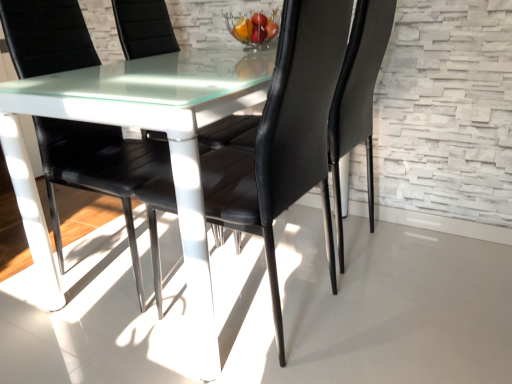
Question: Does black leather chair at center, arranged as the second chair when viewed from the right, appear on the right side of black leather chair at center, the first chair viewed from the right?

Choices:
 (A) no
 (B) yes

Answer: (A)

Question: Is the depth of black leather chair at center, which ranks as the third chair in left-to-right order, less than that of black leather chair at center, the first chair viewed from the right?

Choices:
 (A) yes
 (B) no

Answer: (A)

Question: Does black leather chair at center, which ranks as the third chair in left-to-right order, appear on the left side of black leather chair at center, the first chair viewed from the right?

Choices:
 (A) yes
 (B) no

Answer: (A)

Question: Can you confirm if black leather chair at center, arranged as the second chair when viewed from the right, is shorter than black leather chair at center, the first chair viewed from the right?

Choices:
 (A) no
 (B) yes

Answer: (A)

Question: From the image's perspective, is black leather chair at center, which ranks as the third chair in left-to-right order, above black leather chair at center, the first chair viewed from the right?

Choices:
 (A) no
 (B) yes

Answer: (A)

Question: Looking at their shapes, would you say black leather chair at center, the first chair positioned from the left, is wider or thinner than black leather chair at center, the fourth chair in the left-to-right sequence?

Choices:
 (A) wide
 (B) thin

Answer: (A)

Question: Which is correct: black leather chair at center, which is the 4th chair from right to left, is inside black leather chair at center, the first chair viewed from the right, or outside of it?

Choices:
 (A) inside
 (B) outside

Answer: (B)

Question: In terms of size, does black leather chair at center, which is the 4th chair from right to left, appear bigger or smaller than black leather chair at center, the fourth chair in the left-to-right sequence?

Choices:
 (A) big
 (B) small

Answer: (A)

Question: In terms of height, does black leather chair at center, which is the 4th chair from right to left, look taller or shorter compared to black leather chair at center, the fourth chair in the left-to-right sequence?

Choices:
 (A) short
 (B) tall

Answer: (B)

Question: In terms of height, does black leather chair at center, which appears as the 3th chair when viewed from the right, look taller or shorter compared to black leather chair at center, which ranks as the third chair in left-to-right order?

Choices:
 (A) tall
 (B) short

Answer: (B)

Question: Considering the positions of black leather chair at center, marked as the 2th chair in a left-to-right arrangement, and black leather chair at center, which ranks as the third chair in left-to-right order, in the image, is black leather chair at center, marked as the 2th chair in a left-to-right arrangement, wider or thinner than black leather chair at center, which ranks as the third chair in left-to-right order,?

Choices:
 (A) thin
 (B) wide

Answer: (A)

Question: Based on their positions, is black leather chair at center, marked as the 2th chair in a left-to-right arrangement, located to the left or right of black leather chair at center, which ranks as the third chair in left-to-right order?

Choices:
 (A) left
 (B) right

Answer: (A)

Question: Does point (119, 11) appear closer or farther from the camera than point (270, 258)?

Choices:
 (A) farther
 (B) closer

Answer: (A)

Question: Considering the relative positions of black leather chair at center, the fourth chair in the left-to-right sequence, and black leather chair at center, the first chair positioned from the left, in the image provided, is black leather chair at center, the fourth chair in the left-to-right sequence, to the left or to the right of black leather chair at center, the first chair positioned from the left,?

Choices:
 (A) right
 (B) left

Answer: (A)

Question: In terms of width, does black leather chair at center, the first chair viewed from the right, look wider or thinner when compared to black leather chair at center, which is the 4th chair from right to left?

Choices:
 (A) thin
 (B) wide

Answer: (A)